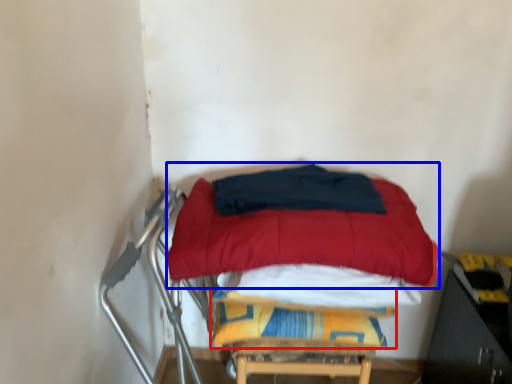
Question: Which object appears farthest to the camera in this image, blanket (highlighted by a red box) or mattress (highlighted by a blue box)?

Choices:
 (A) blanket
 (B) mattress

Answer: (A)